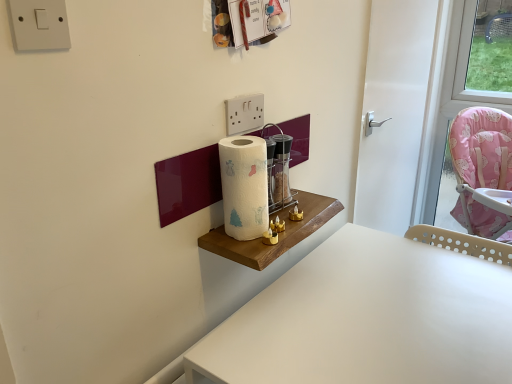
The image size is (512, 384). Identify the location of vacant area located to the right-hand side of transparent glass wine bottle at center. (314, 205).